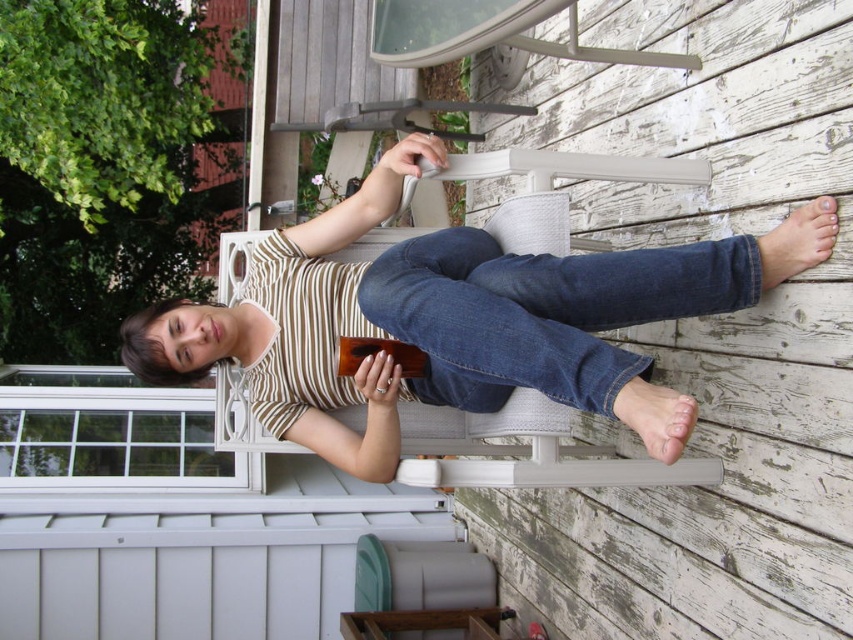
You are designing a layout for a clothing catalog and need to arrange the striped cotton shirt at center and denim at lower right. Based on their positions and sizes in the image, which item should be placed higher up in the catalog layout?

The striped cotton shirt at center should be placed higher up in the catalog layout since it has a greater height compared to the denim at lower right.

You are standing in front of the wooden deck and see two points marked in the image. Which point is closer to you, point (358, 467) or point (537, 304)?

Point (358, 467) is further to the camera than point (537, 304), so point (537, 304) is closer to you.

What is located at the coordinates point (456, 321) in the image?

The point (456, 321) corresponds to the striped cotton shirt at center.